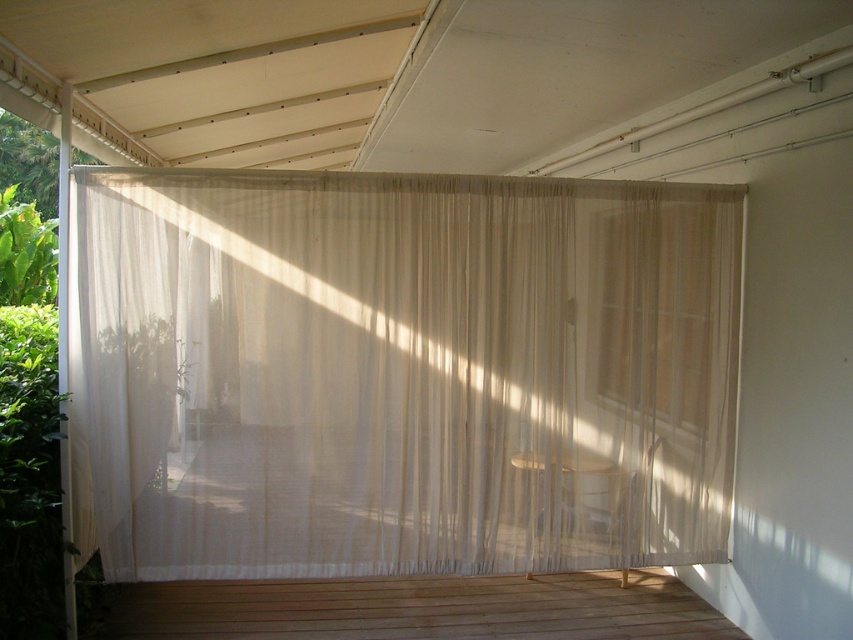
Question: Among these objects, which one is nearest to the camera?

Choices:
 (A) translucent fabric window at upper right
 (B) sheer white curtain at center

Answer: (B)

Question: Which object is the closest to the sheer white curtain at center?

Choices:
 (A) translucent fabric window at upper right
 (B) wooden deck at lower center

Answer: (A)

Question: Does wooden deck at lower center have a smaller size compared to translucent fabric window at upper right?

Choices:
 (A) no
 (B) yes

Answer: (A)

Question: Can you confirm if sheer white curtain at center is positioned to the left of translucent fabric window at upper right?

Choices:
 (A) no
 (B) yes

Answer: (B)

Question: Among these objects, which one is farthest from the camera?

Choices:
 (A) sheer white curtain at center
 (B) wooden deck at lower center
 (C) translucent fabric window at upper right

Answer: (C)

Question: From the image, what is the correct spatial relationship of sheer white curtain at center in relation to translucent fabric window at upper right?

Choices:
 (A) right
 (B) left

Answer: (B)